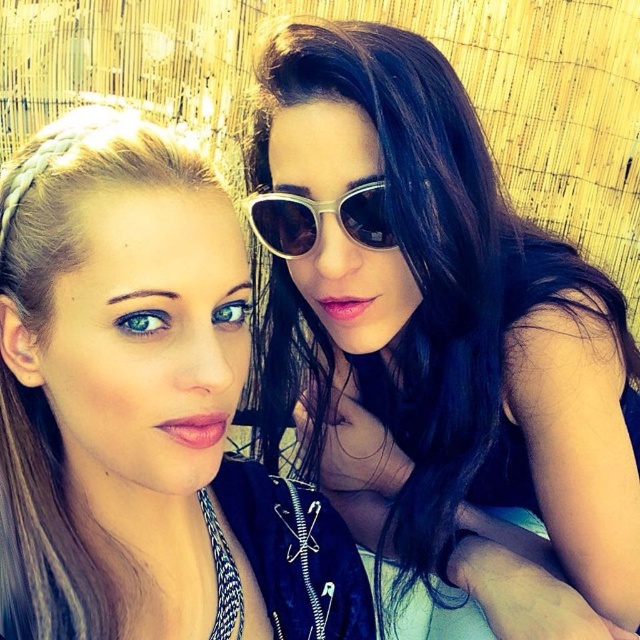
You are a photographer adjusting the camera focus. You need to focus on both the satin black dress at upper right and the metallic silver sunglasses at center. Which object should you focus on first to ensure both are in focus?

You should focus on the satin black dress at upper right first because it is closer to the viewer than the metallic silver sunglasses at center. By focusing on the closer object, the depth of field may allow the farther object to also be in focus.

Consider the image. You are a photographer setting up a shoot. You have to place a matte black jacket at upper left and a metallic silver sunglasses at center in the frame. Given their sizes, which object will occupy more space in the photo?

The matte black jacket at upper left has a larger size compared to metallic silver sunglasses at center, so it will occupy more space in the photo.

You are standing in front of the backdrop and want to place two markers on the points labeled as point [308,403] and point [260,234]. According to the image, which point is closer to you?

Point [260,234] is closer to you because it is in front of point [308,403].